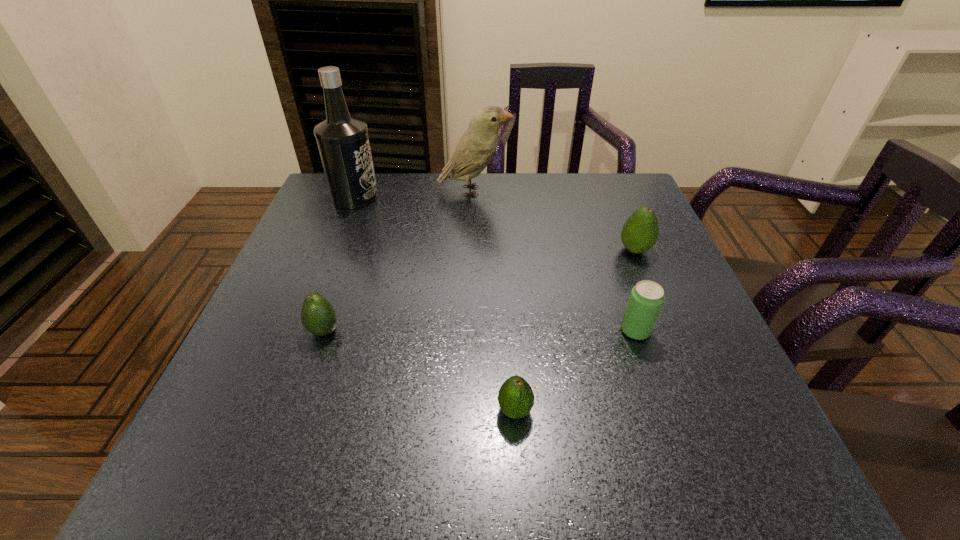
Locate an element on the screen. free space between the tallest object and the bird is located at coordinates (415, 194).

Image resolution: width=960 pixels, height=540 pixels. Find the location of `vacant space in between the liquor and the soda`. vacant space in between the liquor and the soda is located at coordinates (495, 264).

Identify the location of free area in between the second nearest avocado and the bird. (399, 261).

Locate an element on the screen. This screenshot has height=540, width=960. vacant area that lies between the tallest object and the second avocado from right to left is located at coordinates (435, 303).

Where is `unoccupied area between the liquor and the bird`? Image resolution: width=960 pixels, height=540 pixels. unoccupied area between the liquor and the bird is located at coordinates (415, 194).

You are a GUI agent. You are given a task and a screenshot of the screen. Output one action in this format:
    pyautogui.click(x=<x>, y=<y>)
    Task: Click on the free space between the leftmost avocado and the nearest avocado
    Image resolution: width=960 pixels, height=540 pixels.
    Given the screenshot: What is the action you would take?
    pyautogui.click(x=420, y=371)

This screenshot has height=540, width=960. What are the coordinates of `free spot between the soda and the bird` in the screenshot? It's located at (555, 261).

Find the location of a particular element. The image size is (960, 540). the fourth closest object relative to the soda is located at coordinates (318, 316).

Identify which object is the second nearest to the soda. Please provide its 2D coordinates. Your answer should be formatted as a tuple, i.e. [(x, y)], where the tuple contains the x and y coordinates of a point satisfying the conditions above.

[(515, 397)]

Choose which avocado is the nearest neighbor to the second nearest avocado. Please provide its 2D coordinates. Your answer should be formatted as a tuple, i.e. [(x, y)], where the tuple contains the x and y coordinates of a point satisfying the conditions above.

[(515, 397)]